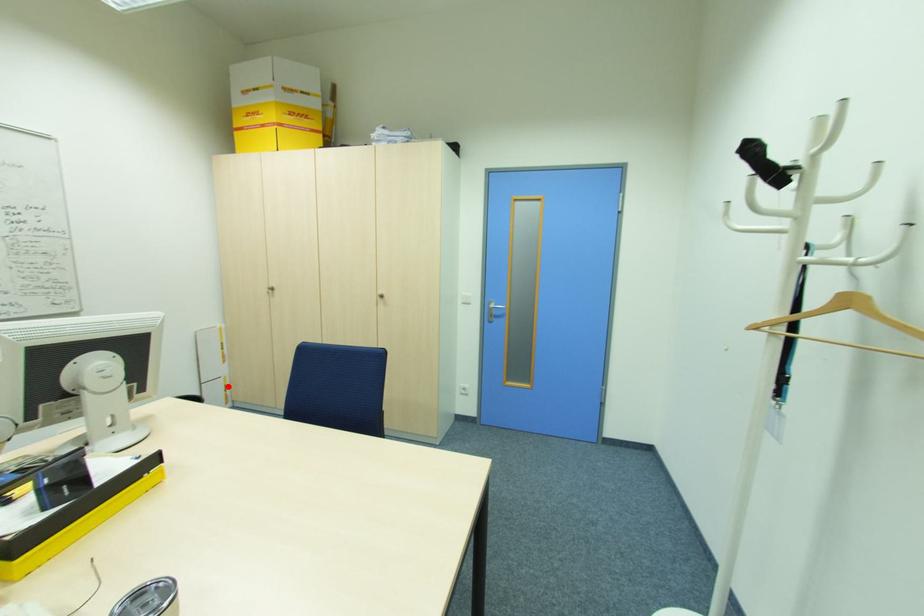
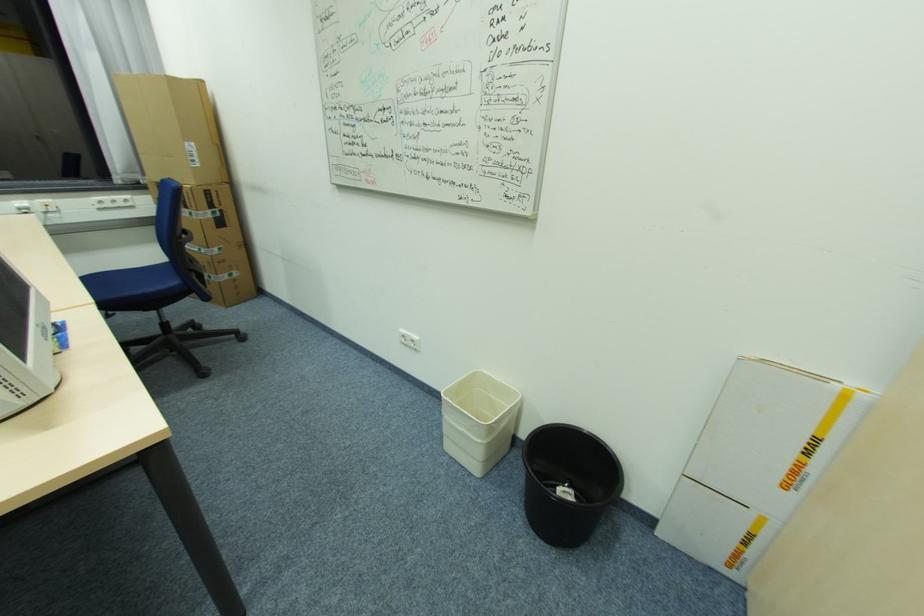
Locate, in the second image, the point that corresponds to the highlighted location in the first image.

(752, 535)